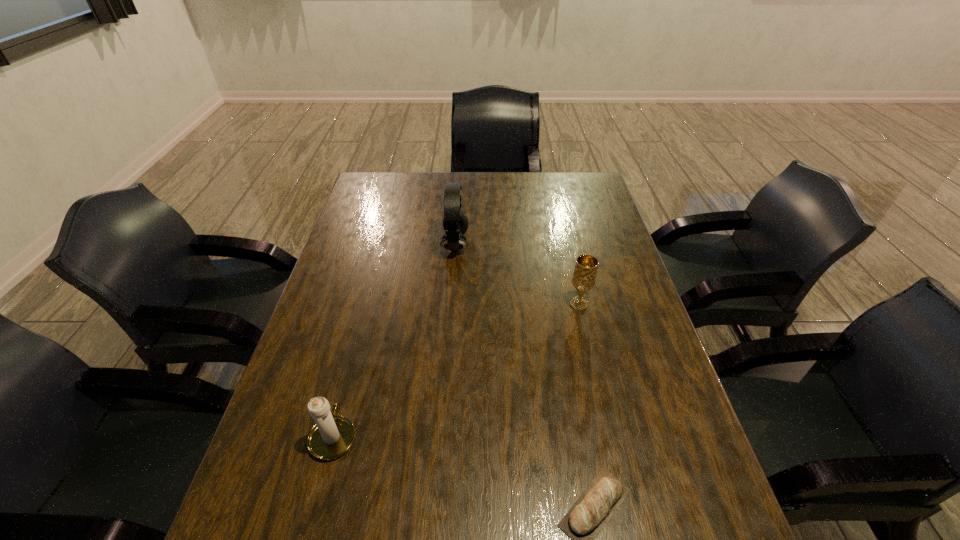
Identify the location of object that can be found as the closest to the shortest object. (332, 436).

Identify the location of object that stands as the second closest to the pita bread. Image resolution: width=960 pixels, height=540 pixels. (584, 276).

Image resolution: width=960 pixels, height=540 pixels. What are the coordinates of `free space that satisfies the following two spatial constraints: 1. on the ear cups of the second object from left to right; 2. on the back side of the chalice` in the screenshot? It's located at (451, 304).

You are a GUI agent. You are given a task and a screenshot of the screen. Output one action in this format:
    pyautogui.click(x=<x>, y=<y>)
    Task: Click on the free point that satisfies the following two spatial constraints: 1. on the ear cups of the tallest object; 2. on the left side of the third nearest object
    The height and width of the screenshot is (540, 960).
    Given the screenshot: What is the action you would take?
    pyautogui.click(x=451, y=304)

Where is `free location that satisfies the following two spatial constraints: 1. on the ear cups of the earphone; 2. on the left side of the chalice`? free location that satisfies the following two spatial constraints: 1. on the ear cups of the earphone; 2. on the left side of the chalice is located at coordinates (451, 304).

Identify the location of vacant space that satisfies the following two spatial constraints: 1. on the back side of the chalice; 2. on the ear cups of the earphone. pos(565,245).